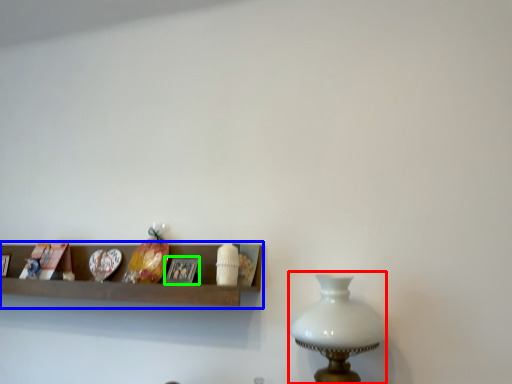
Question: Considering the real-world distances, which object is closest to table lamp (highlighted by a red box)? shelf (highlighted by a blue box) or picture frame (highlighted by a green box).

Choices:
 (A) shelf
 (B) picture frame

Answer: (A)